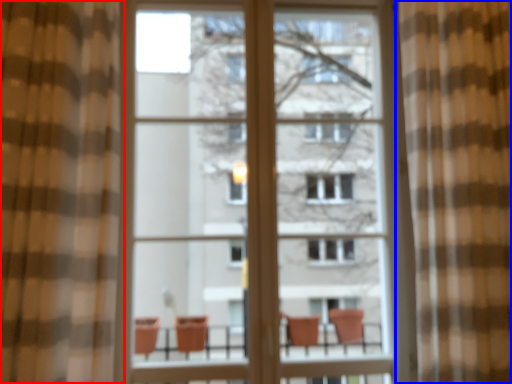
Question: Which point is closer to the camera, curtain (highlighted by a red box) or curtain (highlighted by a blue box)?

Choices:
 (A) curtain
 (B) curtain

Answer: (A)